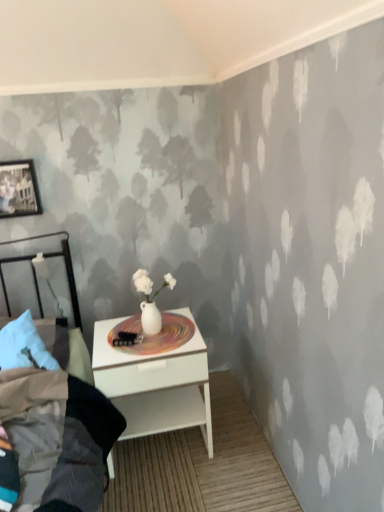
Find the location of a particular element. Image resolution: width=384 pixels, height=512 pixels. vacant space to the right of white glossy nightstand at lower center is located at coordinates (238, 439).